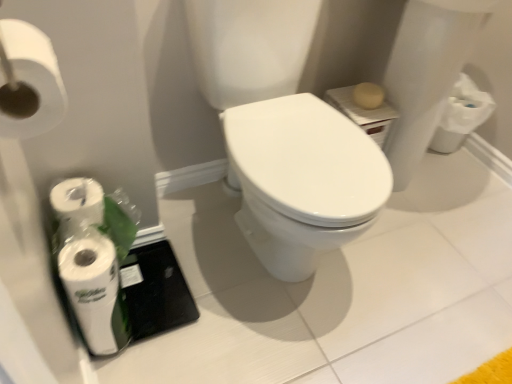
Question: Considering the relative sizes of white matte toilet paper at upper left, which is counted as the second toilet paper, starting from the left, and white matte toilet paper at lower left, the second toilet paper viewed from the front, in the image provided, is white matte toilet paper at upper left, which is counted as the second toilet paper, starting from the left, shorter than white matte toilet paper at lower left, the second toilet paper viewed from the front,?

Choices:
 (A) no
 (B) yes

Answer: (A)

Question: Is white matte toilet paper at upper left, placed as the first toilet paper when sorted from right to left, at the left side of white matte toilet paper at lower left, the first toilet paper ordered from the bottom?

Choices:
 (A) no
 (B) yes

Answer: (A)

Question: Does white matte toilet paper at upper left, which is the first toilet paper from top to bottom, have a lesser width compared to white matte toilet paper at lower left, the 1th toilet paper from the back?

Choices:
 (A) yes
 (B) no

Answer: (B)

Question: Considering the relative sizes of white matte toilet paper at upper left, which is the 1th toilet paper in front-to-back order, and white matte toilet paper at lower left, placed as the second toilet paper when sorted from top to bottom, in the image provided, is white matte toilet paper at upper left, which is the 1th toilet paper in front-to-back order, taller than white matte toilet paper at lower left, placed as the second toilet paper when sorted from top to bottom,?

Choices:
 (A) yes
 (B) no

Answer: (A)

Question: From a real-world perspective, is white matte toilet paper at upper left, the 2th toilet paper positioned from the bottom, located higher than white matte toilet paper at lower left, which is the 2th toilet paper in right-to-left order?

Choices:
 (A) yes
 (B) no

Answer: (A)

Question: Can you confirm if white matte toilet paper at upper left, which is counted as the second toilet paper, starting from the left, is positioned to the right of white matte toilet paper at lower left, placed as the second toilet paper when sorted from top to bottom?

Choices:
 (A) no
 (B) yes

Answer: (B)

Question: From the image's perspective, is white matte toilet paper at lower left, the first toilet paper ordered from the bottom, beneath white matte toilet paper at upper left, placed as the first toilet paper when sorted from right to left?

Choices:
 (A) no
 (B) yes

Answer: (B)

Question: Can you confirm if white matte toilet paper at lower left, which is the 2th toilet paper in right-to-left order, is wider than white matte toilet paper at upper left, which is counted as the second toilet paper, starting from the left?

Choices:
 (A) yes
 (B) no

Answer: (B)

Question: Is white matte toilet paper at lower left, placed as the second toilet paper when sorted from top to bottom, turned away from white matte toilet paper at upper left, placed as the first toilet paper when sorted from right to left?

Choices:
 (A) yes
 (B) no

Answer: (B)

Question: From a real-world perspective, is white matte toilet paper at lower left, which is the 2th toilet paper in right-to-left order, below white matte toilet paper at upper left, which is counted as the second toilet paper, starting from the left?

Choices:
 (A) no
 (B) yes

Answer: (B)

Question: Is white matte toilet paper at lower left, the first toilet paper ordered from the bottom, smaller than white matte toilet paper at upper left, which is the 1th toilet paper in front-to-back order?

Choices:
 (A) no
 (B) yes

Answer: (B)

Question: Is white matte toilet paper at lower left, which is the 2th toilet paper in right-to-left order, in contact with white matte toilet paper at upper left, which is the 1th toilet paper in front-to-back order?

Choices:
 (A) yes
 (B) no

Answer: (B)

Question: From the image's perspective, is white matte toilet paper at upper left, which appears as the 2th toilet paper when viewed from the back, above or below white matte toilet paper at lower left, the second toilet paper viewed from the front?

Choices:
 (A) below
 (B) above

Answer: (B)